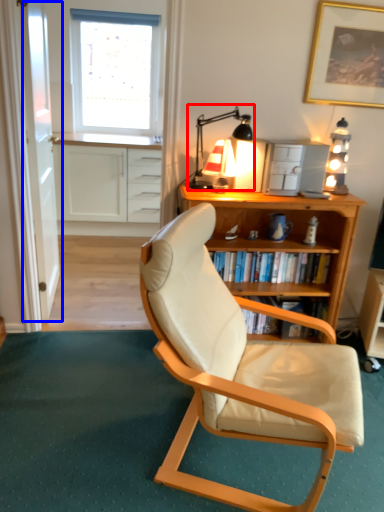
Question: Which object is further to the camera taking this photo, table lamp (highlighted by a red box) or glass door (highlighted by a blue box)?

Choices:
 (A) table lamp
 (B) glass door

Answer: (B)